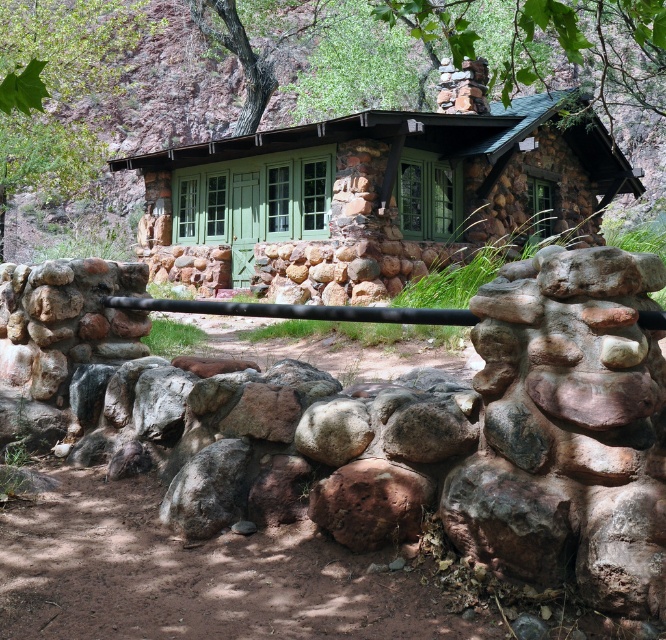
You are standing in front of the green stone cabin at center and looking towards the green stone chimney at upper center. Which object is higher in position relative to the other?

The green stone chimney at upper center is higher than the green stone cabin at center.

You are standing in a forest clearing and see the green stone cabin at center. If you want to take a photo of it from a distance of exactly 11 meters, should you move closer or farther away?

The green stone cabin at center is currently 10.95 meters away from the camera. To achieve a distance of exactly 11 meters, you should move slightly farther away from the cabin.

You are a visitor standing in front of the green stone cabin at center and the green stone chimney at upper center. Which object is wider?

The green stone cabin at center is wider than the green stone chimney at upper center.